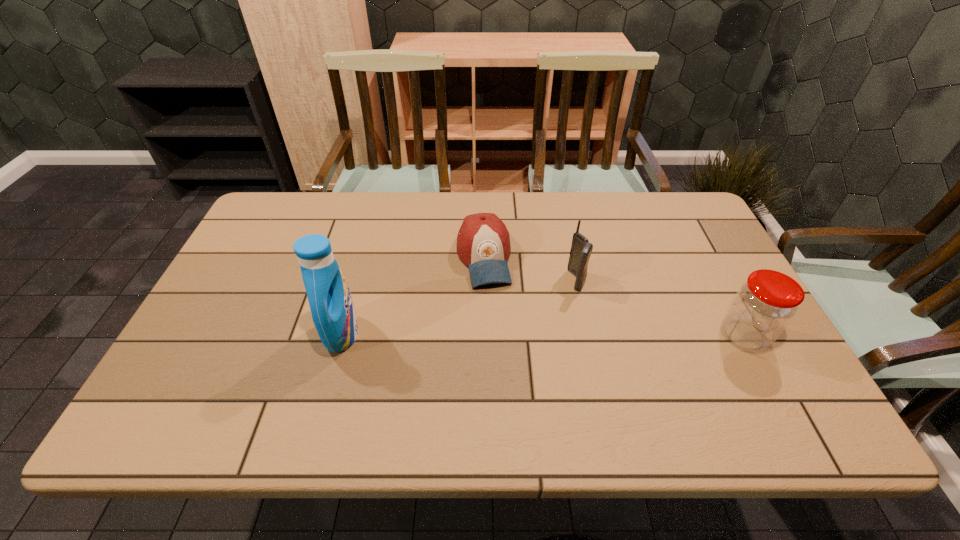
You are a GUI agent. You are given a task and a screenshot of the screen. Output one action in this format:
    pyautogui.click(x=<x>, y=<y>)
    Task: Click on the free space between the rightmost object and the second object from left to right
    This screenshot has width=960, height=540.
    Given the screenshot: What is the action you would take?
    pyautogui.click(x=613, y=297)

Find the location of a particular element. Image resolution: width=960 pixels, height=540 pixels. free space between the detergent and the jar is located at coordinates (543, 335).

Identify which object is located as the third nearest to the jar. Please provide its 2D coordinates. Your answer should be formatted as a tuple, i.e. [(x, y)], where the tuple contains the x and y coordinates of a point satisfying the conditions above.

[(333, 313)]

Choose which object is the third nearest neighbor to the jar. Please provide its 2D coordinates. Your answer should be formatted as a tuple, i.e. [(x, y)], where the tuple contains the x and y coordinates of a point satisfying the conditions above.

[(333, 313)]

Where is `free space in the image that satisfies the following two spatial constraints: 1. on the front side of the rightmost object; 2. on the right side of the baseball cap`? This screenshot has height=540, width=960. free space in the image that satisfies the following two spatial constraints: 1. on the front side of the rightmost object; 2. on the right side of the baseball cap is located at coordinates (484, 335).

Find the location of `free spot that satisfies the following two spatial constraints: 1. on the front side of the shortest object; 2. on the left side of the second object from right to left`. free spot that satisfies the following two spatial constraints: 1. on the front side of the shortest object; 2. on the left side of the second object from right to left is located at coordinates (484, 280).

Image resolution: width=960 pixels, height=540 pixels. Identify the location of free space that satisfies the following two spatial constraints: 1. on the front side of the rightmost object; 2. on the right side of the baseball cap. (484, 335).